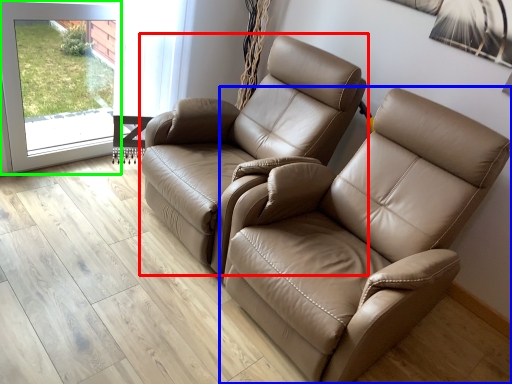
Question: Which object is positioned closest to chair (highlighted by a red box)? Select from chair (highlighted by a blue box) and screen door (highlighted by a green box).

Choices:
 (A) chair
 (B) screen door

Answer: (A)